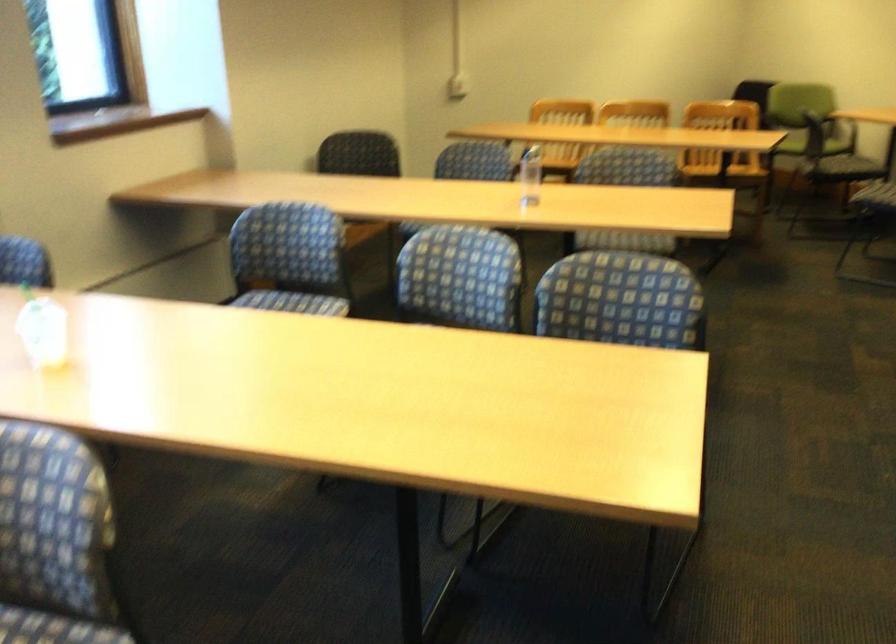
At what (x,y) coordinates should I click in order to perform the action: click on white light switch. Please return your answer as a coordinate pair (x, y). The height and width of the screenshot is (644, 896). Looking at the image, I should click on (458, 86).